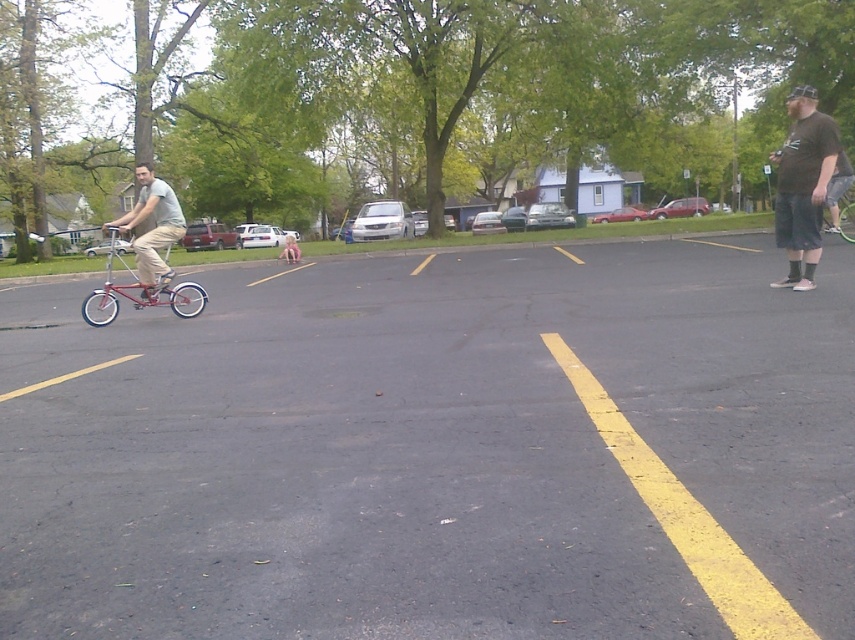
Question: Does dark gray shorts at right lie in front of metallic silver bicycle at left?

Choices:
 (A) yes
 (B) no

Answer: (A)

Question: Estimate the real-world distances between objects in this image. Which object is farther from the dark gray shorts at right?

Choices:
 (A) shiny red bicycle at left
 (B) metallic silver bicycle at right
 (C) black asphalt parking lot at center
 (D) metallic silver bicycle at left

Answer: (D)

Question: Considering the relative positions of dark gray shorts at right and metallic silver bicycle at right in the image provided, where is dark gray shorts at right located with respect to metallic silver bicycle at right?

Choices:
 (A) below
 (B) above

Answer: (B)

Question: Is metallic silver bicycle at left closer to camera compared to metallic silver bicycle at right?

Choices:
 (A) no
 (B) yes

Answer: (B)

Question: Which object appears closest to the camera in this image?

Choices:
 (A) metallic silver bicycle at right
 (B) metallic silver bicycle at left

Answer: (B)

Question: Which object is the farthest from the dark gray shorts at right?

Choices:
 (A) metallic silver bicycle at right
 (B) metallic silver bicycle at left
 (C) black asphalt parking lot at center
 (D) shiny red bicycle at left

Answer: (B)